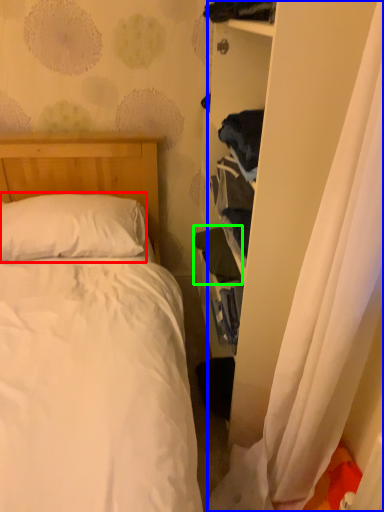
Question: Considering the real-world distances, which object is closest to pillow (highlighted by a red box)? curtain (highlighted by a blue box) or clothing (highlighted by a green box).

Choices:
 (A) curtain
 (B) clothing

Answer: (B)